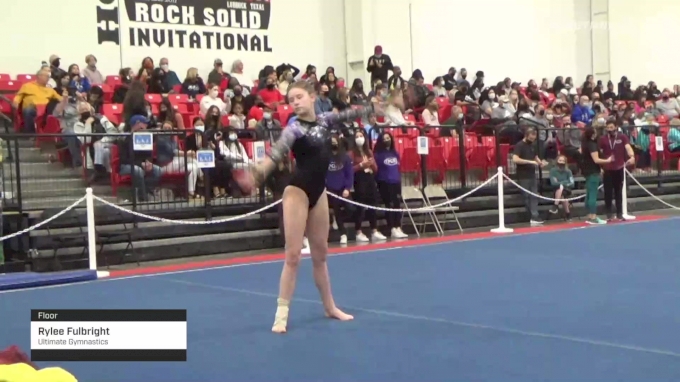
Locate an element on the screen. stairs is located at coordinates (64, 250), (54, 234), (54, 210), (39, 188), (32, 167), (18, 150), (9, 144), (3, 132).